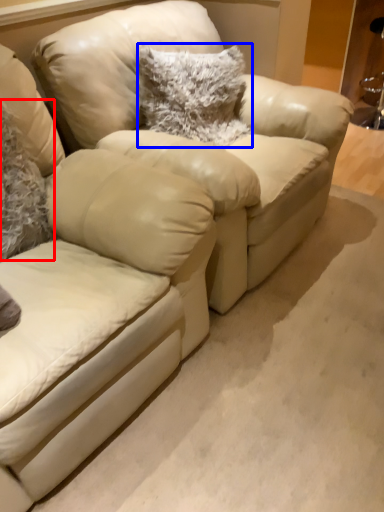
Question: Which point is closer to the camera, pillow (highlighted by a red box) or pillow (highlighted by a blue box)?

Choices:
 (A) pillow
 (B) pillow

Answer: (A)